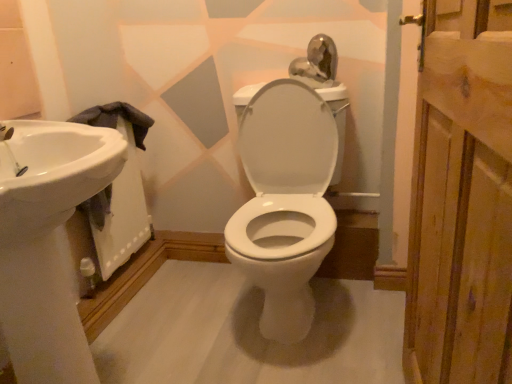
Locate an element on the screen. Image resolution: width=512 pixels, height=384 pixels. vacant space underneath white glossy sink at left (from a real-world perspective) is located at coordinates (124, 266).